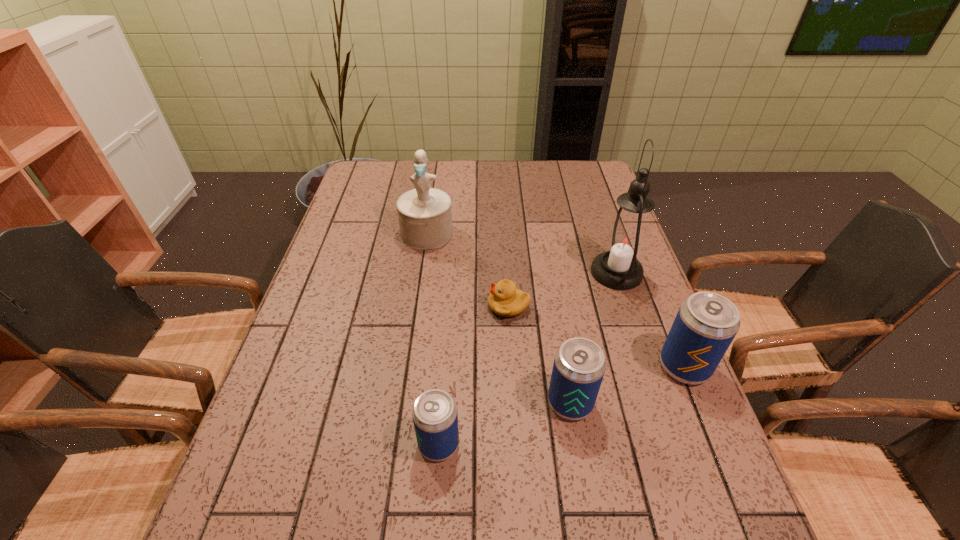
The image size is (960, 540). Find the location of `vacant space situated 0.140m on the right of the shortest beer can`. vacant space situated 0.140m on the right of the shortest beer can is located at coordinates (531, 444).

The height and width of the screenshot is (540, 960). I want to click on vacant space located on the right of the second beer can from right to left, so click(687, 402).

Find the location of `free space located on the back of the rightmost beer can`. free space located on the back of the rightmost beer can is located at coordinates (649, 280).

Image resolution: width=960 pixels, height=540 pixels. In order to click on vacant area situated at the beak of the farthest object in this screenshot , I will do `click(409, 357)`.

The image size is (960, 540). In order to click on free spot located on the front-facing side of the fourth object from right to left in this screenshot , I will do `click(461, 306)`.

This screenshot has height=540, width=960. I want to click on free space located on the front-facing side of the fourth object from right to left, so click(x=387, y=306).

This screenshot has width=960, height=540. In order to click on vacant region located 0.290m on the front-facing side of the fourth object from right to left in this screenshot , I will do `click(375, 306)`.

Where is `vacant space located 0.080m on the front of the oil lamp`? This screenshot has height=540, width=960. vacant space located 0.080m on the front of the oil lamp is located at coordinates (632, 319).

Find the location of a particular element. The image size is (960, 540). object at the near edge is located at coordinates (434, 413).

Image resolution: width=960 pixels, height=540 pixels. I want to click on beer can located at the right edge, so click(706, 323).